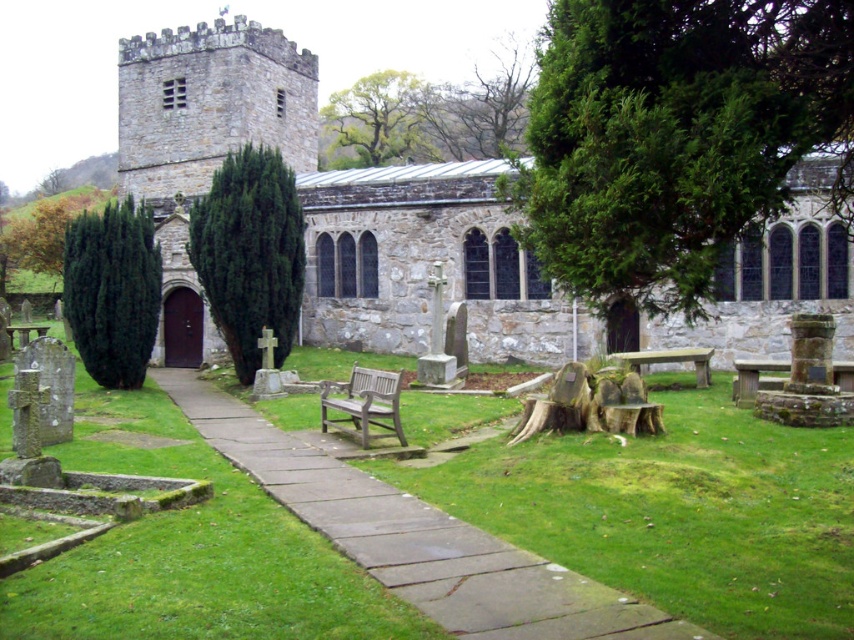
Question: Which of these objects is positioned farthest from the wooden bench at center?

Choices:
 (A) green leafy tree at upper center
 (B) wooden bench at lower right

Answer: (A)

Question: Is smooth stone path at center above wooden bench at lower right?

Choices:
 (A) yes
 (B) no

Answer: (B)

Question: Among these points, which one is nearest to the camera?

Choices:
 (A) (765, 365)
 (B) (776, 160)

Answer: (B)

Question: Does smooth stone path at center lie in front of green leafy tree at upper center?

Choices:
 (A) yes
 (B) no

Answer: (A)

Question: Estimate the real-world distances between objects in this image. Which object is farther from the green coniferous tree at right?

Choices:
 (A) wooden park bench at center right
 (B) wooden bench at lower right
 (C) wooden bench at center

Answer: (A)

Question: Is green coniferous tree at right wider than wooden bench at center?

Choices:
 (A) yes
 (B) no

Answer: (A)